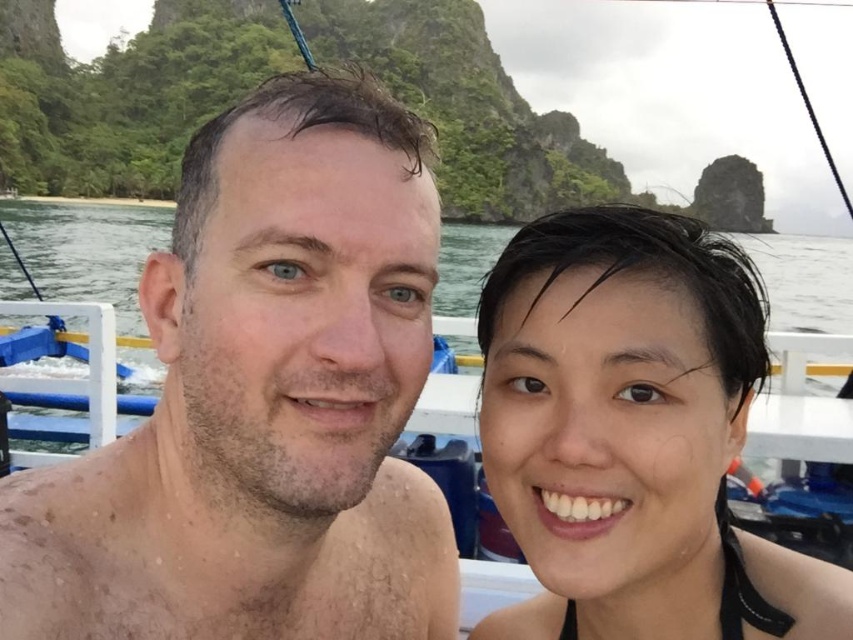
Question: Is dry skin at center smaller than clear blue water at center?

Choices:
 (A) no
 (B) yes

Answer: (B)

Question: Which is nearer to the dry skin at center?

Choices:
 (A) black matte hair at upper right
 (B) clear blue water at center

Answer: (A)

Question: Is dry skin at center thinner than clear blue water at center?

Choices:
 (A) yes
 (B) no

Answer: (A)

Question: Is dry skin at center wider than clear blue water at center?

Choices:
 (A) no
 (B) yes

Answer: (A)

Question: Which point is farther from the camera taking this photo?

Choices:
 (A) tap(457, 276)
 (B) tap(578, 611)

Answer: (A)

Question: Which point is closer to the camera?

Choices:
 (A) clear blue water at center
 (B) dry skin at center
 (C) black matte hair at upper right

Answer: (B)